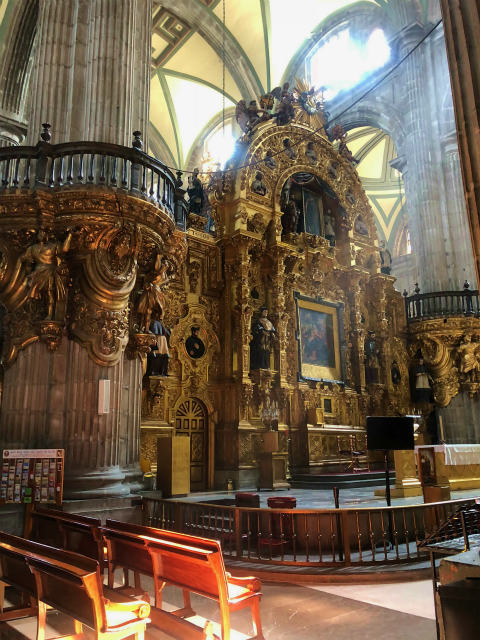
Where is `stand`? stand is located at coordinates (385, 443).